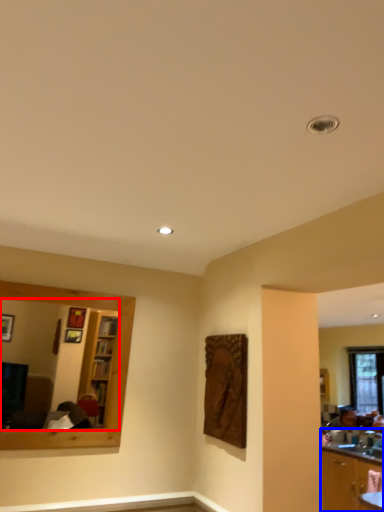
Question: Which object is closer to the camera taking this photo, mirror (highlighted by a red box) or cabinetry (highlighted by a blue box)?

Choices:
 (A) mirror
 (B) cabinetry

Answer: (A)